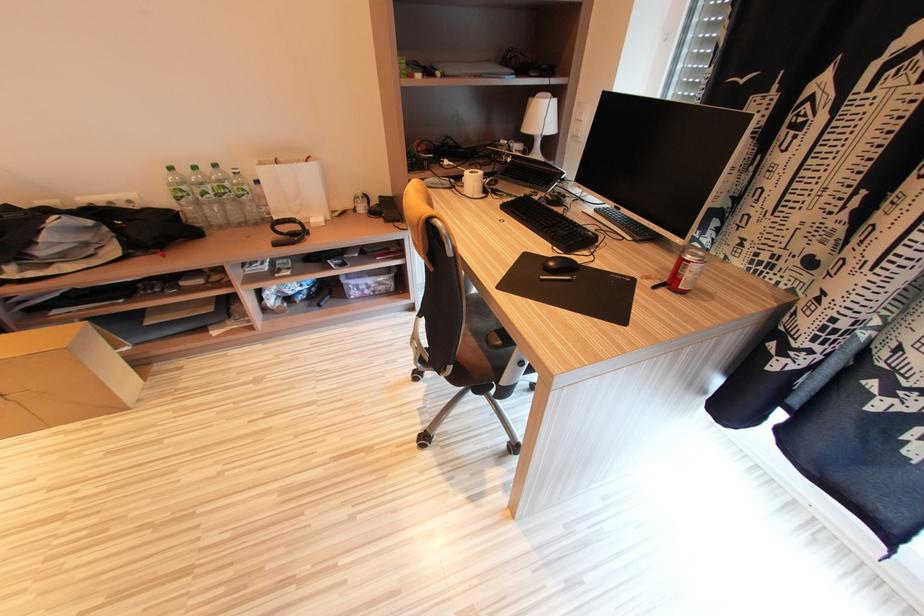
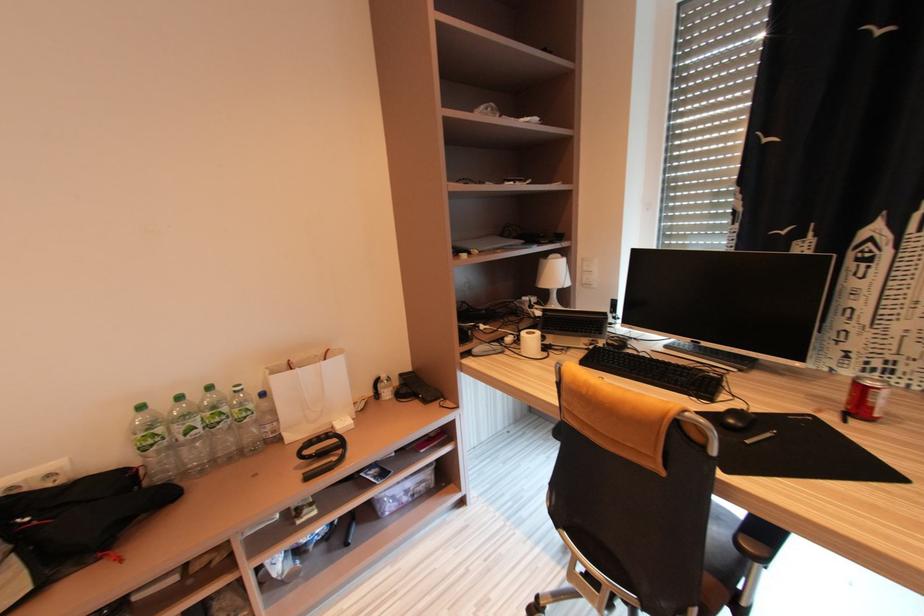
Based on the continuous images, in which direction is the camera rotating?

The camera rotated toward right-up.